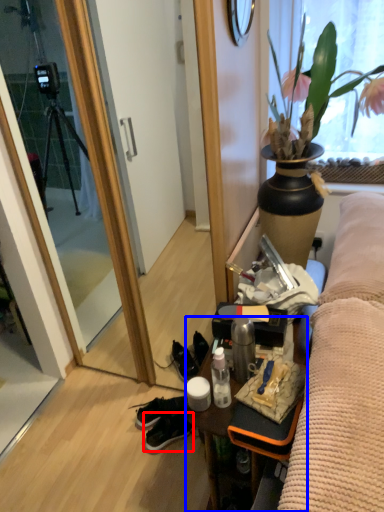
Question: Which object appears farthest to the camera in this image, sneakers (highlighted by a red box) or desk (highlighted by a blue box)?

Choices:
 (A) sneakers
 (B) desk

Answer: (A)